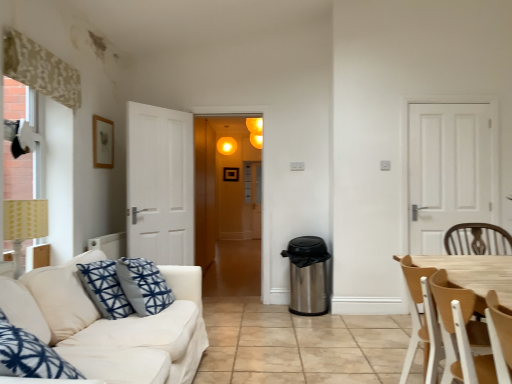
Question: Visually, is blue printed cushion at lower left, arranged as the first pillow when viewed from the left, positioned to the left or to the right of matte yellow lampshade at left?

Choices:
 (A) right
 (B) left

Answer: (A)

Question: Is blue printed cushion at lower left, arranged as the first pillow when viewed from the left, taller or shorter than matte yellow lampshade at left?

Choices:
 (A) short
 (B) tall

Answer: (A)

Question: Which is nearer to the white matte door at right?

Choices:
 (A) matte yellow light at upper center
 (B) light brown wood chair at right
 (C) matte yellow lampshade at left
 (D) translucent glass screen door at center
 (E) blue printed cushion at left, which ranks as the 2th pillow in left-to-right order

Answer: (B)

Question: Based on their relative distances, which object is farther from the blue printed cushion at lower left, arranged as the first pillow when viewed from the left?

Choices:
 (A) white fabric couch at lower left
 (B) matte yellow lampshade at left
 (C) translucent glass screen door at center
 (D) camouflage fabric curtain at upper left
 (E) white matte door at right

Answer: (C)